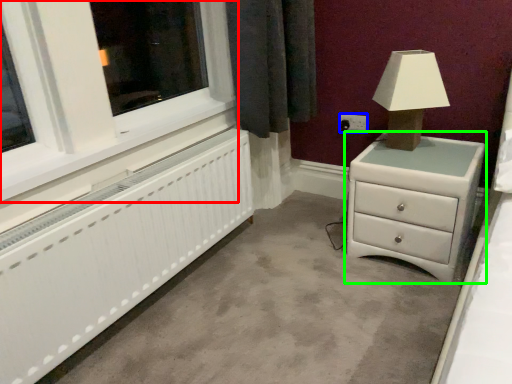
Question: Estimate the real-world distances between objects in this image. Which object is closer to window frame (highlighted by a red box), electric outlet (highlighted by a blue box) or chest of drawers (highlighted by a green box)?

Choices:
 (A) electric outlet
 (B) chest of drawers

Answer: (B)